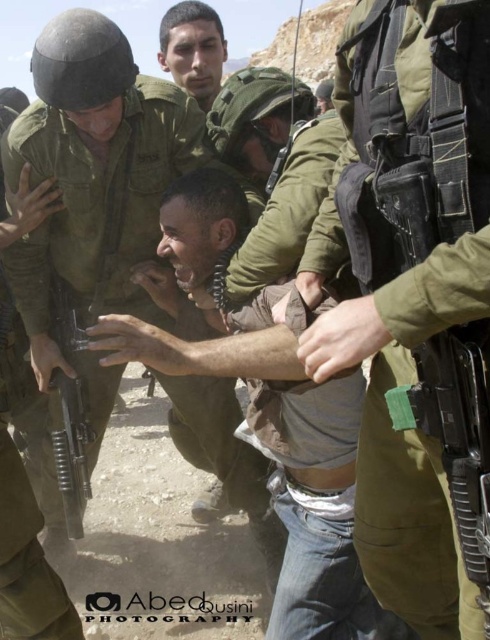
You are a military supply officer tasked with packing gear into a storage container. The container has a maximum weight capacity of 100 kg. The green fabric uniform at center weighs 3 kg, and the matte black rifle at center weighs 5 kg. If you need to include both items in the container, how many of each can you fit without exceeding the weight limit?

The green fabric uniform at center weighs 3 kg and the matte black rifle at center weighs 5 kg. To maximize the number of items without exceeding the 100 kg limit, you can carry 20 green fabric uniforms at center and 8 matte black rifles at center. This combination would total 20 x 3 kg plus 8 x 5 kg equals 60 kg plus 40 kg equals 100 kg exactly.

Based on the coordinates provided, what is the object located at point (430, 240) in the image?

The object located at point (430, 240) is the green fabric uniform at center.

You are a soldier positioned at the point marked as point (441, 408). Your commander has instructed you to move forward 3 meters to secure a strategic position. Can you safely reach this position without exceeding the distance limit?

The distance of point (441, 408) from viewer is 2.70 meters. Moving forward 3 meters would take you to 5.70 meters away from the original position, but since the question specifies moving to secure a strategic position 3 meters ahead from your current position, you can safely do so as the distance from the viewer would then be 2.70 meters plus 3 meters equals 5.70 meters. However, the answer should focus on whether moving 3 meters forward from your current position is possible without exceeding the given